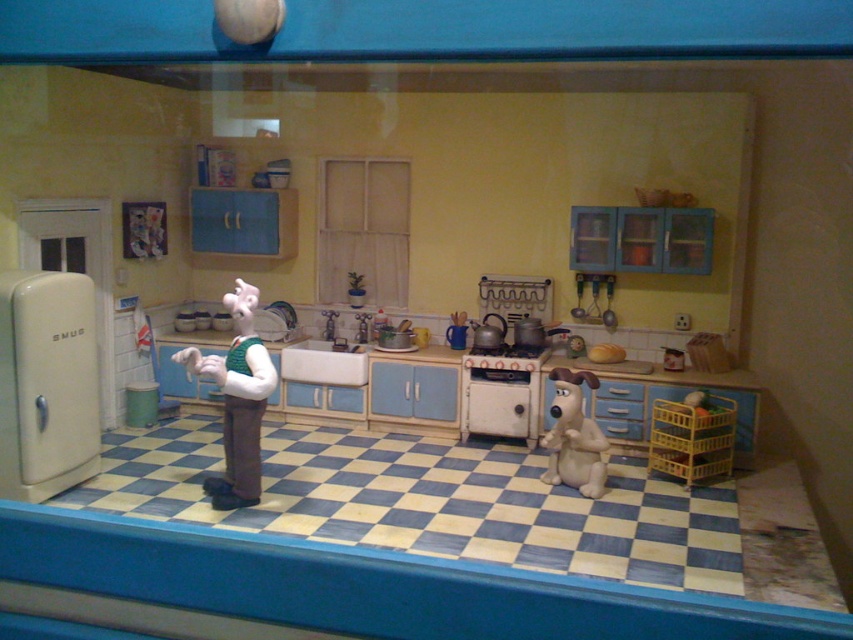
Question: Which object is the closest to the fuzzy beige dog at center?

Choices:
 (A) white plush toy at center
 (B) cream matte refrigerator at left

Answer: (A)

Question: Does cream matte refrigerator at left have a larger size compared to white plush toy at center?

Choices:
 (A) no
 (B) yes

Answer: (A)

Question: Which object is the closest to the fuzzy beige dog at center?

Choices:
 (A) white plush toy at center
 (B) cream matte refrigerator at left

Answer: (A)

Question: Does cream matte refrigerator at left have a lesser width compared to fuzzy beige dog at center?

Choices:
 (A) yes
 (B) no

Answer: (A)

Question: Among these points, which one is nearest to the camera?

Choices:
 (A) (18, 401)
 (B) (247, 305)

Answer: (B)

Question: From the image, what is the correct spatial relationship of white plush toy at center in relation to fuzzy beige dog at center?

Choices:
 (A) above
 (B) below

Answer: (A)